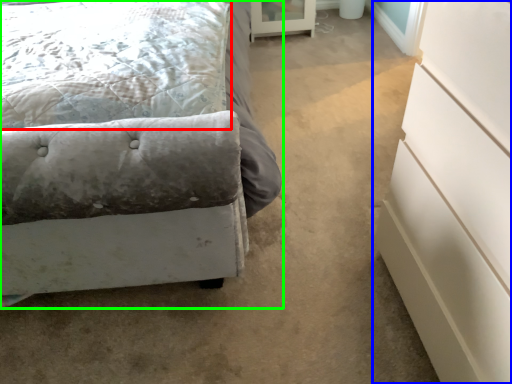
Question: Which object is positioned closest to pillow (highlighted by a red box)? Select from chest of drawers (highlighted by a blue box) and bed (highlighted by a green box).

Choices:
 (A) chest of drawers
 (B) bed

Answer: (B)